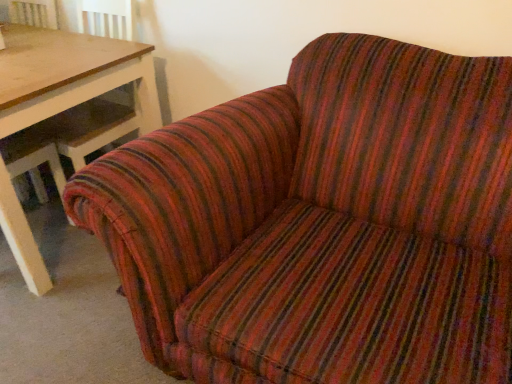
In order to face wooden table at left, should I rotate leftwards or rightwards?

Turn left approximately 30.233 degrees to face it.

Describe the element at coordinates (68, 74) in the screenshot. I see `wooden table at left` at that location.

What is the approximate height of wooden table at left?

It is 29.13 inches.

The image size is (512, 384). Identify the location of wooden table at left. (68, 74).

The height and width of the screenshot is (384, 512). I want to click on wooden table at left, so click(68, 74).